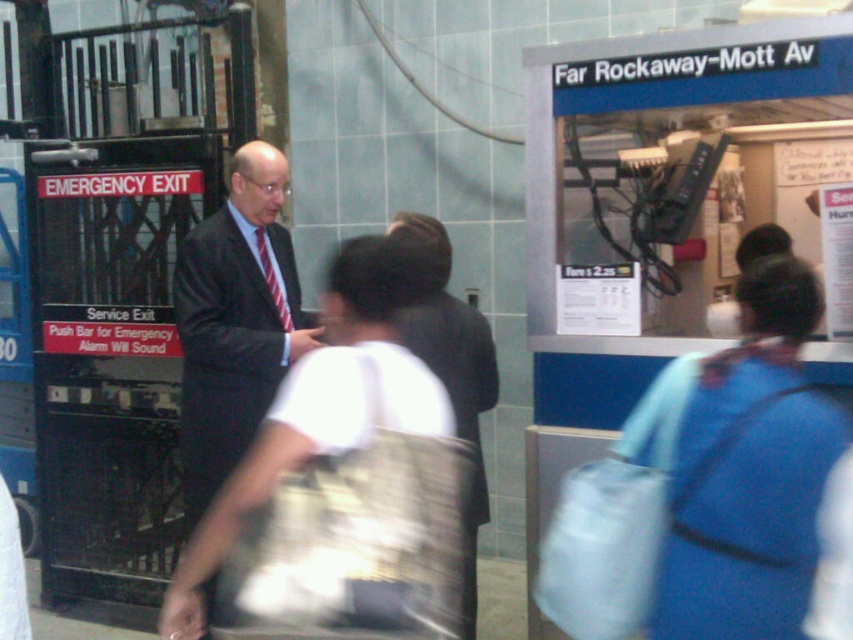
Measure the distance between blue fabric bag at center and white fabric bag at center.

blue fabric bag at center and white fabric bag at center are 24.72 inches apart from each other.

Which is more to the left, blue fabric bag at center or white fabric bag at center?

Positioned to the left is white fabric bag at center.

Is point (657, 614) behind point (207, 515)?

That is False.

The width and height of the screenshot is (853, 640). I want to click on blue fabric bag at center, so [743, 468].

Can you confirm if white fabric bag at center is positioned to the right of dark suit at left?

Correct, you'll find white fabric bag at center to the right of dark suit at left.

Is white fabric bag at center taller than dark suit at left?

Incorrect, white fabric bag at center's height is not larger of dark suit at left's.

Who is more distant from viewer, (405,392) or (206,268)?

The point (206,268) is more distant.

At what (x,y) coordinates should I click in order to perform the action: click on white fabric bag at center. Please return your answer as a coordinate pair (x, y). Looking at the image, I should click on (325, 403).

Is point (782, 504) more distant than point (204, 228)?

No, (782, 504) is closer to viewer.

Does blue fabric bag at center have a lesser width compared to dark suit at left?

Correct, blue fabric bag at center's width is less than dark suit at left's.

Find the location of a particular element. Image resolution: width=853 pixels, height=640 pixels. blue fabric bag at center is located at coordinates (743, 468).